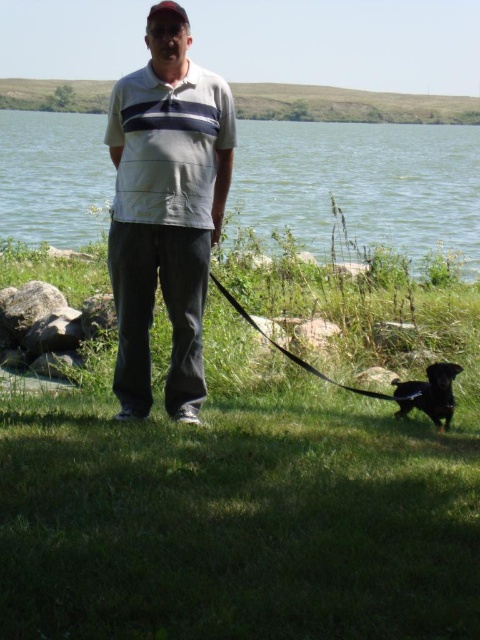
Does white striped shirt at center have a smaller size compared to shiny black dog at lower right?

Incorrect, white striped shirt at center is not smaller in size than shiny black dog at lower right.

Measure the distance between white striped shirt at center and camera.

They are 4.47 meters apart.

Who is more forward, (232,106) or (437,396)?

Positioned in front is point (232,106).

This screenshot has height=640, width=480. Identify the location of white striped shirt at center. (166, 209).

Between point (466, 125) and point (414, 392), which one is positioned in front?

Point (414, 392) is in front.

Is clear water at center smaller than shiny black dog at lower right?

No.

Does point (442, 141) lie in front of point (446, 397)?

No, (442, 141) is behind (446, 397).

Where is `clear water at center`? The image size is (480, 640). clear water at center is located at coordinates (361, 184).

Does green grass at lower center have a lesser width compared to white striped shirt at center?

Yes.

Does green grass at lower center have a smaller size compared to white striped shirt at center?

Yes.

Image resolution: width=480 pixels, height=640 pixels. In order to click on green grass at lower center in this screenshot , I will do click(x=243, y=500).